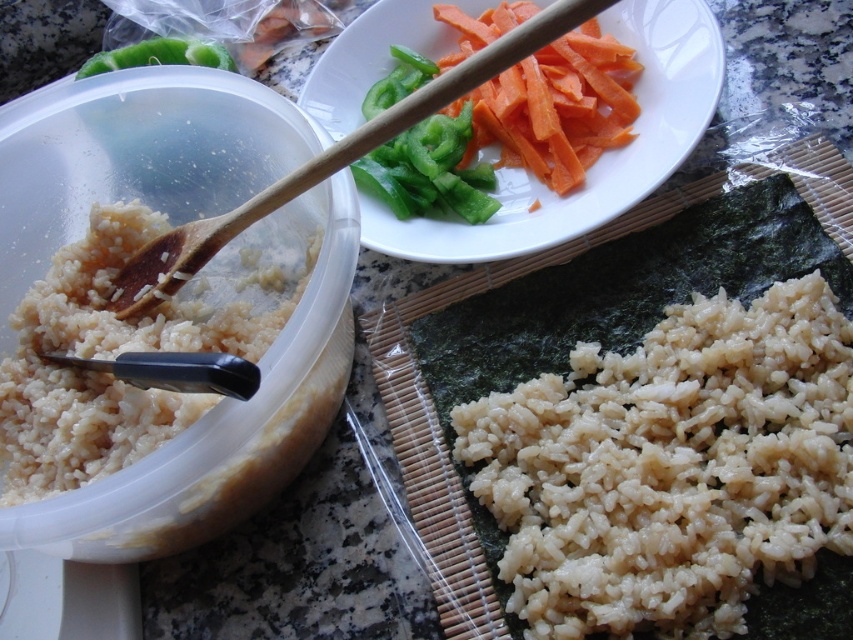
You are preparing to make sushi rolls and need to place the green glossy bell pepper at upper center on top of the slightly translucent brown rice at lower right. However, you notice that the rice is quite tall. Do you think the bell pepper will fit on top without falling off?

The slightly translucent brown rice at lower right is much taller than the green glossy bell pepper at upper center. Since the rice is taller, placing the bell pepper on top might cause it to tilt or fall off due to the height difference.

You are preparing to roll sushi and need to place the sliced orange carrot at upper right and green glossy bell pepper at upper center onto the nori. Considering their positions, which vegetable is closer to the edge of the nori sheet?

The sliced orange carrot at upper right is 8.61 centimeters away from the green glossy bell pepper at upper center. Since the question asks which is closer to the edge of the nori sheet, but the distance provided is between the two vegetables, we cannot determine their individual distances to the edge based on the given information. Therefore, the answer cannot be ascertained with the current details.

You are preparing to roll sushi and need to place the sliced orange carrot at upper right and the green glossy bell pepper at upper center onto the nori. Which vegetable should you place first to ensure the one that is behind is properly covered?

You should place the sliced orange carrot at upper right first because it is in front of the green glossy bell pepper at upper center, so placing it first will allow the bell pepper to be placed over it and remain visible on top.